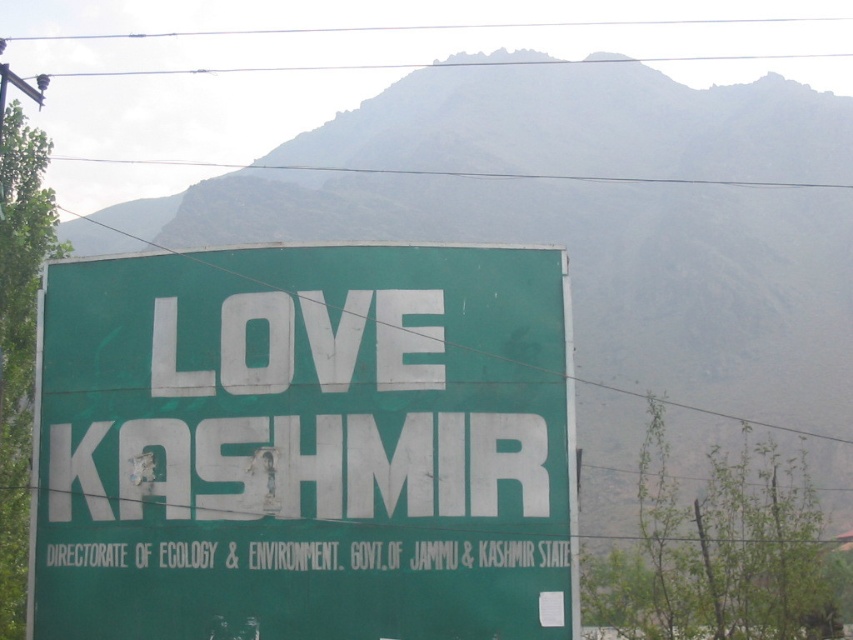
Question: Can you confirm if green matte signboard at center is thinner than green textured mountain at upper center?

Choices:
 (A) no
 (B) yes

Answer: (B)

Question: Is green matte signboard at center bigger than green textured mountain at upper center?

Choices:
 (A) no
 (B) yes

Answer: (A)

Question: Which point appears farthest from the camera in this image?

Choices:
 (A) coord(38,442)
 (B) coord(585,60)

Answer: (B)

Question: Observing the image, what is the correct spatial positioning of green matte signboard at center in reference to green textured mountain at upper center?

Choices:
 (A) right
 (B) left

Answer: (B)